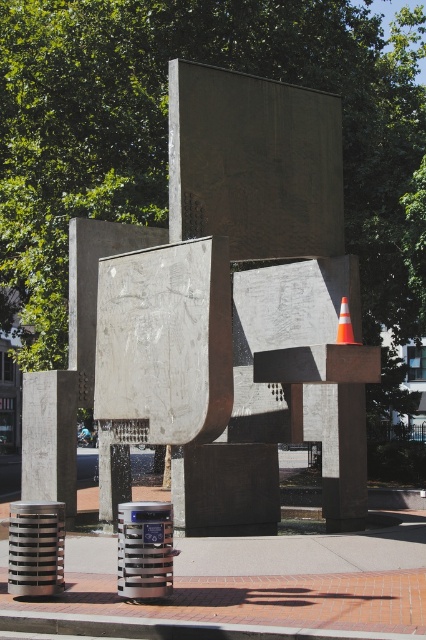
Question: Considering the relative positions of smooth concrete sculpture at center and orange reflective cone at center in the image provided, where is smooth concrete sculpture at center located with respect to orange reflective cone at center?

Choices:
 (A) right
 (B) left

Answer: (B)

Question: Considering the relative positions of smooth concrete sculpture at center and orange reflective cone at center in the image provided, where is smooth concrete sculpture at center located with respect to orange reflective cone at center?

Choices:
 (A) above
 (B) below

Answer: (A)

Question: Is smooth concrete sculpture at center to the right of orange reflective cone at center from the viewer's perspective?

Choices:
 (A) no
 (B) yes

Answer: (A)

Question: Among these points, which one is farthest from the camera?

Choices:
 (A) (233, 225)
 (B) (336, 333)

Answer: (B)

Question: Which object is farther from the camera taking this photo?

Choices:
 (A) smooth concrete sculpture at center
 (B) orange reflective cone at center

Answer: (B)